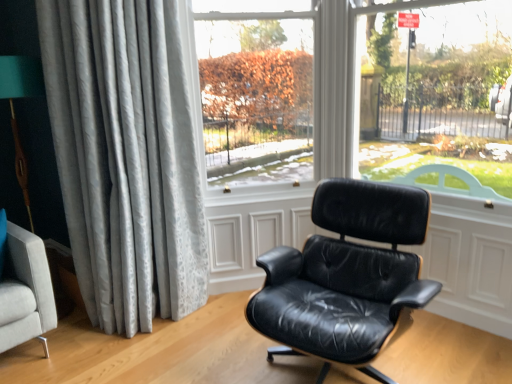
Question: Is black leather chair at center at the back of transparent glass window at center?

Choices:
 (A) no
 (B) yes

Answer: (A)

Question: Can you confirm if transparent glass window at center is wider than black leather chair at center?

Choices:
 (A) no
 (B) yes

Answer: (A)

Question: Does transparent glass window at center have a larger size compared to black leather chair at center?

Choices:
 (A) no
 (B) yes

Answer: (A)

Question: Would you say transparent glass window at center is outside black leather chair at center?

Choices:
 (A) yes
 (B) no

Answer: (A)

Question: Is transparent glass window at center facing towards black leather chair at center?

Choices:
 (A) no
 (B) yes

Answer: (B)

Question: Is transparent glass window at center wider or thinner than silvery textured curtain at left?

Choices:
 (A) thin
 (B) wide

Answer: (A)

Question: Is transparent glass window at center spatially inside silvery textured curtain at left, or outside of it?

Choices:
 (A) outside
 (B) inside

Answer: (A)

Question: From the image's perspective, is transparent glass window at center above or below silvery textured curtain at left?

Choices:
 (A) above
 (B) below

Answer: (A)

Question: Does point (294, 129) appear closer or farther from the camera than point (160, 198)?

Choices:
 (A) farther
 (B) closer

Answer: (A)

Question: Considering the positions of black leather chair at center and transparent glass window at center in the image, is black leather chair at center wider or thinner than transparent glass window at center?

Choices:
 (A) wide
 (B) thin

Answer: (A)

Question: Relative to transparent glass window at center, is black leather chair at center in front or behind?

Choices:
 (A) front
 (B) behind

Answer: (A)

Question: Considering the positions of black leather chair at center and transparent glass window at center in the image, is black leather chair at center bigger or smaller than transparent glass window at center?

Choices:
 (A) big
 (B) small

Answer: (A)

Question: Is point (352, 218) positioned closer to the camera than point (284, 21)?

Choices:
 (A) farther
 (B) closer

Answer: (B)

Question: Is silvery textured curtain at left inside the boundaries of black leather chair at center, or outside?

Choices:
 (A) outside
 (B) inside

Answer: (A)

Question: From their relative heights in the image, would you say silvery textured curtain at left is taller or shorter than black leather chair at center?

Choices:
 (A) tall
 (B) short

Answer: (A)